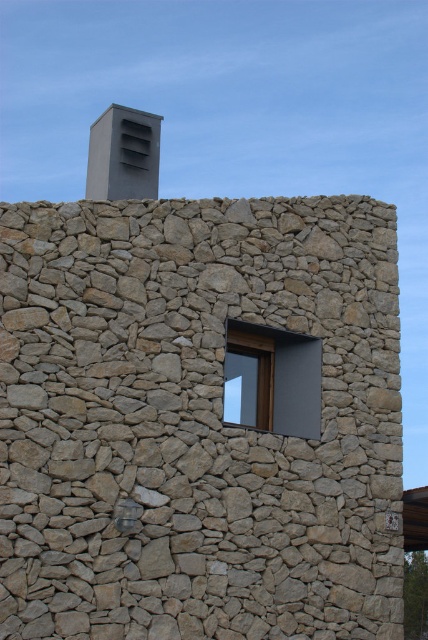
Question: Which point is closer to the camera?

Choices:
 (A) gray matte chimney at upper center
 (B) natural stone wall at center
 (C) matte gray window at center

Answer: (B)

Question: From the image, what is the correct spatial relationship of natural stone wall at center in relation to gray matte chimney at upper center?

Choices:
 (A) right
 (B) left

Answer: (A)

Question: Is natural stone wall at center in front of matte gray window at center?

Choices:
 (A) no
 (B) yes

Answer: (B)

Question: Which object is closer to the camera taking this photo?

Choices:
 (A) gray matte chimney at upper center
 (B) natural stone wall at center
 (C) matte gray window at center

Answer: (B)

Question: Considering the real-world distances, which object is closest to the matte gray window at center?

Choices:
 (A) gray matte chimney at upper center
 (B) natural stone wall at center

Answer: (B)

Question: Considering the relative positions of natural stone wall at center and matte gray window at center in the image provided, where is natural stone wall at center located with respect to matte gray window at center?

Choices:
 (A) below
 (B) above

Answer: (A)